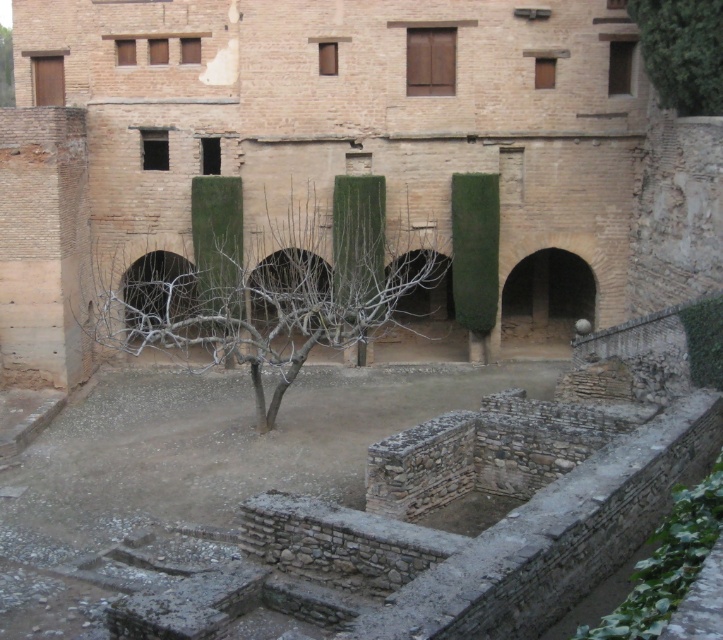
You are a gardener who wants to plant a new tree in the courtyard. The new tree will grow to be 3 meters wide. There is already a green leafy tree at upper right and brown stone ruins at center. Can you plant the new tree between them without it overlapping with either?

The distance between the brown stone ruins at center and the green leafy tree at upper right is 5.22 meters. Since the new tree will be 3 meters wide, planting it between them would require at least 1.5 meters of space on each side. However, the total required space would be 3 meters for the tree plus 3 meters for the spacing, totaling 6 meters, which exceeds the 5.22 meters available. Therefore, the new tree cannot be planted between them without overlapping.

You are standing in the courtyard and want to walk towards the green leafy tree at upper left. Which direction should you move relative to the bare branches at center?

You should move to the left relative to the bare branches at center because the green leafy tree at upper left is located to the left of the bare branches at center.

You are an architect examining the historical courtyard. You notice the brown stone ruins at center and the green leafy tree at upper right. Which object is closer to the viewer?

The brown stone ruins at center are closer to the viewer than the green leafy tree at upper right because the tree is positioned behind the ruins.